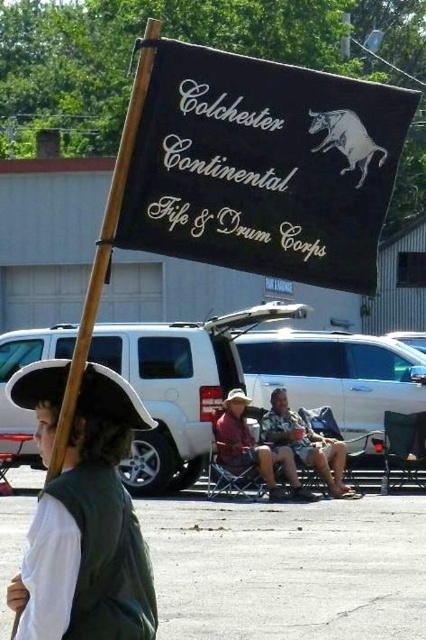
In the scene shown: You are organizing a parade and need to know which object is smaller between the white matte hat at left and the wooden pole at upper left. Can you identify the smaller one?

The white matte hat at left has a smaller size compared to the wooden pole at upper left, so the white matte hat at left is the smaller object.

Consider the image. You are organizing a community event and need to determine if the white matte hat at left can fit through a narrow doorway that the denim jacket at center is currently blocking. Based on their sizes, can the hat pass through the space next to the jacket?

The white matte hat at left is thinner than the denim jacket at center, so it can likely pass through the space next to the jacket without issue.

You are standing in the parking lot and want to read the text on the black fabric sign at upper center. Considering your current position, can you easily read the text without moving closer?

The black fabric sign at upper center is 3.19 meters from viewer, so yes, you can easily read the text without moving closer since it is within a comfortable reading distance.